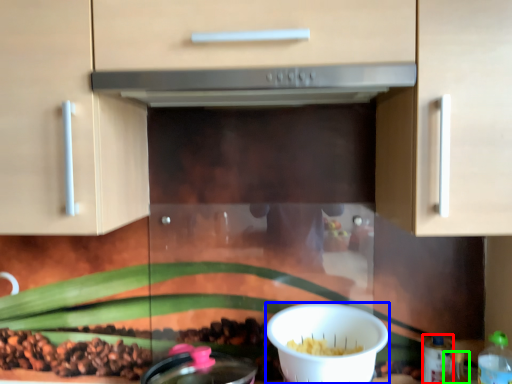
Question: Which object is positioned farthest from bottle (highlighted by a red box)? Select from bowl (highlighted by a blue box) and bottle (highlighted by a green box).

Choices:
 (A) bowl
 (B) bottle

Answer: (A)